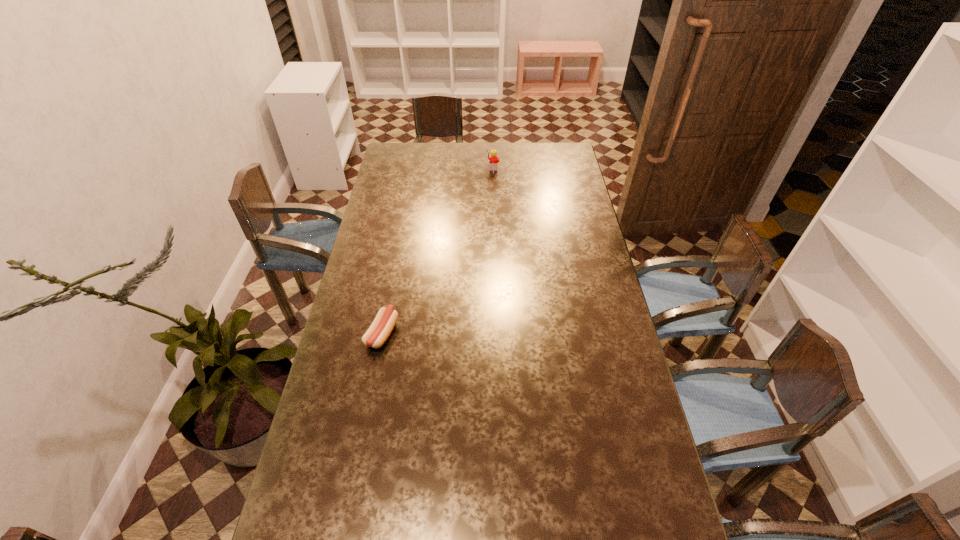
Find the location of a particular element. This screenshot has width=960, height=540. vacant space at the far edge of the desktop is located at coordinates (453, 156).

Locate an element on the screen. vacant space at the left edge of the desktop is located at coordinates (398, 221).

This screenshot has width=960, height=540. In the image, there is a desktop. Find the location of `free space at the right edge`. free space at the right edge is located at coordinates (576, 188).

Locate an element on the screen. free point at the far right corner is located at coordinates (566, 146).

This screenshot has width=960, height=540. In order to click on free spot between the shorter object and the farther object in this screenshot , I will do `click(438, 250)`.

At what (x,y) coordinates should I click in order to perform the action: click on vacant region between the sausage and the Lego. Please return your answer as a coordinate pair (x, y). The height and width of the screenshot is (540, 960). Looking at the image, I should click on (438, 250).

Locate an element on the screen. The image size is (960, 540). free space between the taller object and the nearer object is located at coordinates (438, 250).

The image size is (960, 540). I want to click on free area in between the farther object and the left object, so click(x=438, y=250).

The image size is (960, 540). Find the location of `vacant area that satisfies the following two spatial constraints: 1. in front of the right object with the accessory visible; 2. on the front side of the sausage`. vacant area that satisfies the following two spatial constraints: 1. in front of the right object with the accessory visible; 2. on the front side of the sausage is located at coordinates (499, 333).